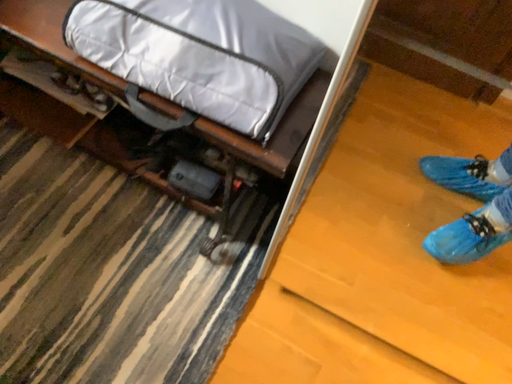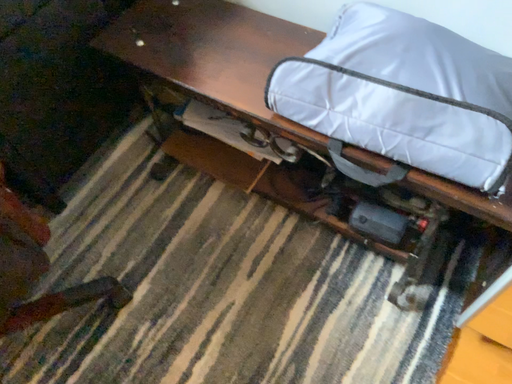
Question: How did the camera likely rotate when shooting the video?

Choices:
 (A) rotated right
 (B) rotated left

Answer: (B)